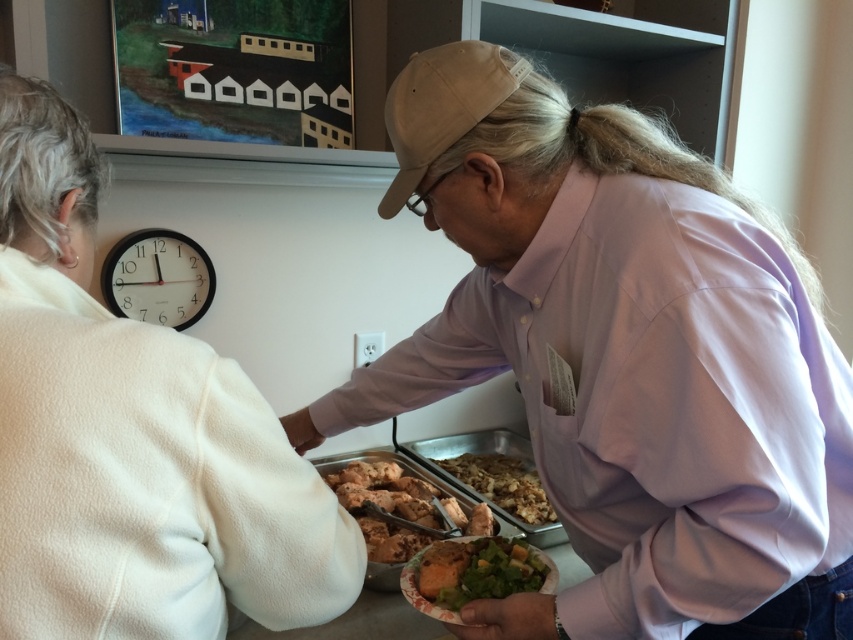
You are a photographer taking a picture of the pink cotton shirt at center and the golden brown mashed potatoes at center. Which object will appear closer to the camera in the photo?

The pink cotton shirt at center is in front of the golden brown mashed potatoes at center, so it will appear closer to the camera in the photo.

In the scene shown: You are at a buffet and need to grab your plate before the clock strikes 10. You see the white fleece jacket at upper left and the golden brown bread at lower center. Which object is closer to the top of the image?

The white fleece jacket at upper left is above the golden brown bread at lower center, so it is closer to the top of the image.

You are at a buffet and need to reach for a drink on the table behind the pink cotton shirt at center and the white fleece jacket at upper left. Which object do you need to move first to access the drink?

You need to move the white fleece jacket at upper left first because the pink cotton shirt at center is positioned under it, meaning the jacket is closer to you.